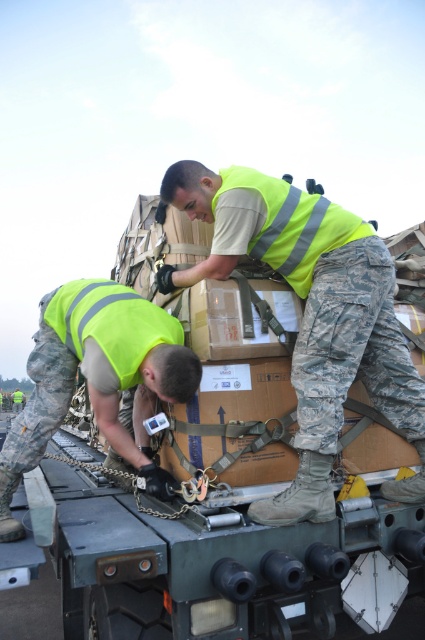
The image size is (425, 640). What do you see at coordinates (229, 499) in the screenshot?
I see `green camouflage trailer truck at center` at bounding box center [229, 499].

Does green camouflage trailer truck at center have a smaller size compared to yellow reflective vest at upper center?

No, green camouflage trailer truck at center is not smaller than yellow reflective vest at upper center.

Describe the element at coordinates (229, 499) in the screenshot. I see `green camouflage trailer truck at center` at that location.

Image resolution: width=425 pixels, height=640 pixels. I want to click on green camouflage trailer truck at center, so click(x=229, y=499).

Can you confirm if yellow reflective vest at upper center is positioned above yellow reflective vest at center?

Yes.

Does point (263, 509) come in front of point (136, 332)?

Yes, point (263, 509) is in front of point (136, 332).

Where is `yellow reflective vest at upper center`? This screenshot has height=640, width=425. yellow reflective vest at upper center is located at coordinates (311, 316).

Which of these two, green camouflage trailer truck at center or yellow reflective vest at center, stands taller?

green camouflage trailer truck at center is taller.

Is point (130, 563) farther from viewer compared to point (30, 369)?

No, it is not.

Is point (146, 579) positioned before point (67, 330)?

Yes, it is.

Find the location of a particular element. The image size is (425, 640). green camouflage trailer truck at center is located at coordinates (229, 499).